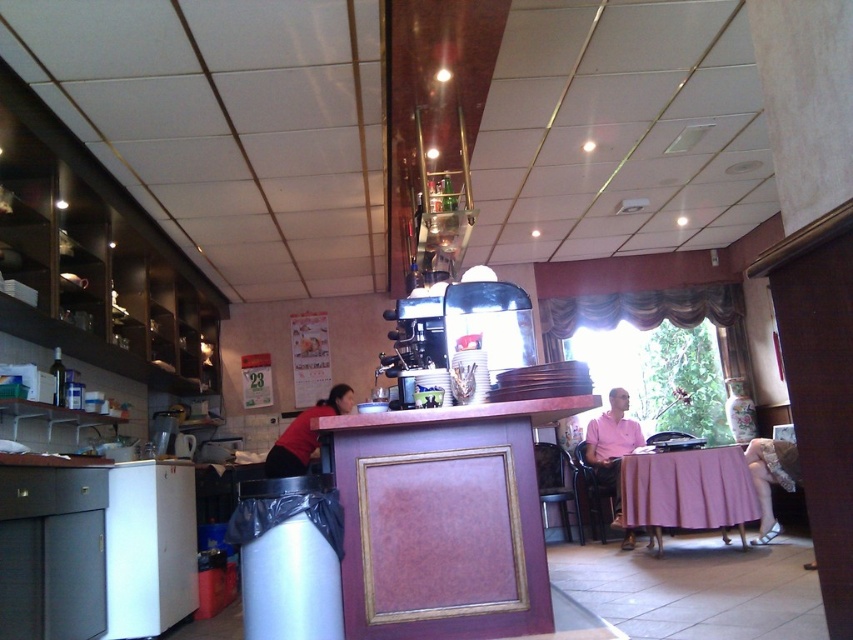
You are a customer entering the cafe and want to sit at the pink fabric table at lower right. However, you notice the red shirt at counter is currently in use. Is the table higher or lower than the counter where the red shirt is located?

The pink fabric table at lower right has a greater height compared to the red shirt at counter, so the table is higher than the counter where the red shirt is located.

You are standing in the kitchen area of the small cafe and see two points marked on the wall. The first point is at coordinate point (631, 460) and the second is at coordinate point (306, 428). Which point is closer to you?

Point (306, 428) is closer to you because it is in front of point (631, 460).